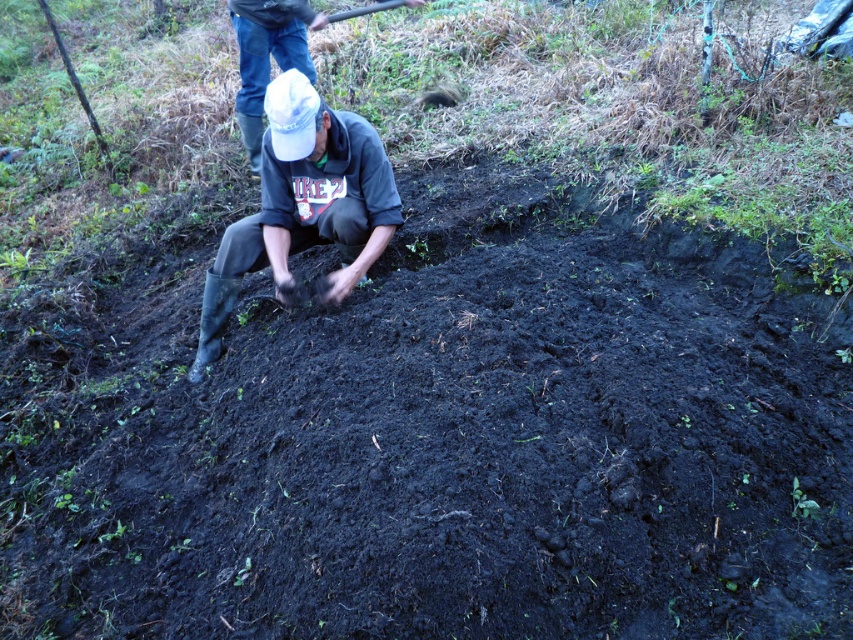
You are standing in the garden and see the rubber boots at center and the denim jeans at upper center. Which piece of clothing is positioned to the right of the other?

The rubber boots at center are to the right of denim jeans at upper center.

From the picture: You are a delivery robot with a 1.5 meter wide package. You need to navigate through the space between the rubber boots at center and the denim jeans at upper center. Can you fit through the gap without moving either object?

The gap between the rubber boots at center and the denim jeans at upper center is 1.82 meters. Since your package is 1.5 meters wide, you can fit through the gap as it is wider than the package.

You are standing in the garden and want to place a watering can between the rubber boots at center and the denim jeans at upper center. Which object should you place it closer to if you want it to be nearer to the viewer?

You should place the watering can closer to the rubber boots at center because it is closer to the viewer than the denim jeans at upper center.